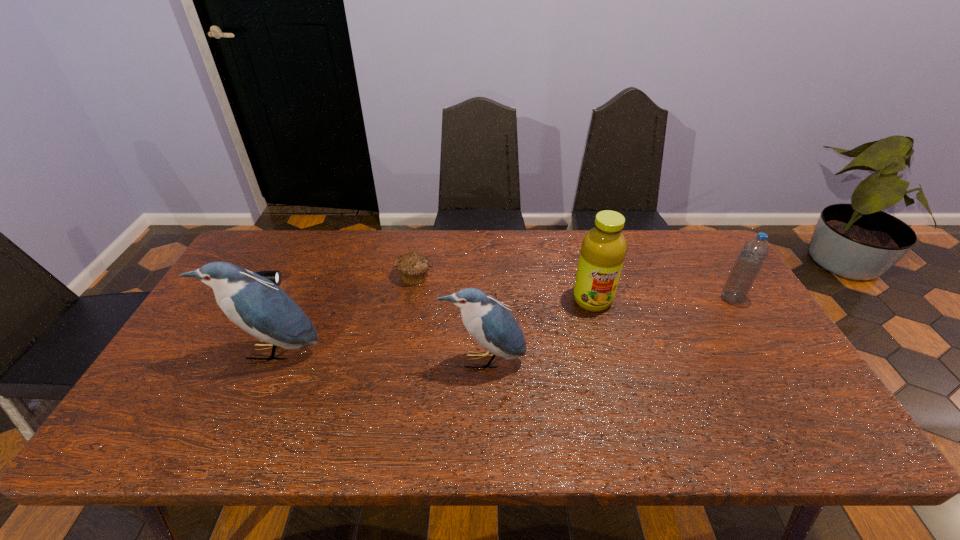
This screenshot has height=540, width=960. Identify the location of free area in between the rightmost object and the second object from right to left. (661, 299).

Where is `unoccupied area between the fruit juice and the fourth object from left to right`? This screenshot has height=540, width=960. unoccupied area between the fruit juice and the fourth object from left to right is located at coordinates (538, 330).

Locate an element on the screen. This screenshot has height=540, width=960. object that is the second closest one to the rightmost object is located at coordinates [x=488, y=321].

Identify which object is the second nearest to the fifth object from left to right. Please provide its 2D coordinates. Your answer should be formatted as a tuple, i.e. [(x, y)], where the tuple contains the x and y coordinates of a point satisfying the conditions above.

[(752, 256)]

Image resolution: width=960 pixels, height=540 pixels. In order to click on vacant space that satisfies the following two spatial constraints: 1. at the lens end of the shortest object; 2. on the right side of the rightmost object in this screenshot , I will do click(243, 299).

Locate an element on the screen. free space that satisfies the following two spatial constraints: 1. at the lens end of the flashlight; 2. on the right side of the rightmost object is located at coordinates (x=243, y=299).